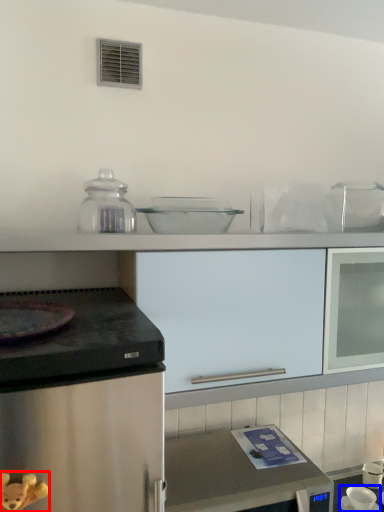
Question: Which object is closer to the camera taking this photo, toy (highlighted by a red box) or appliance (highlighted by a blue box)?

Choices:
 (A) toy
 (B) appliance

Answer: (A)